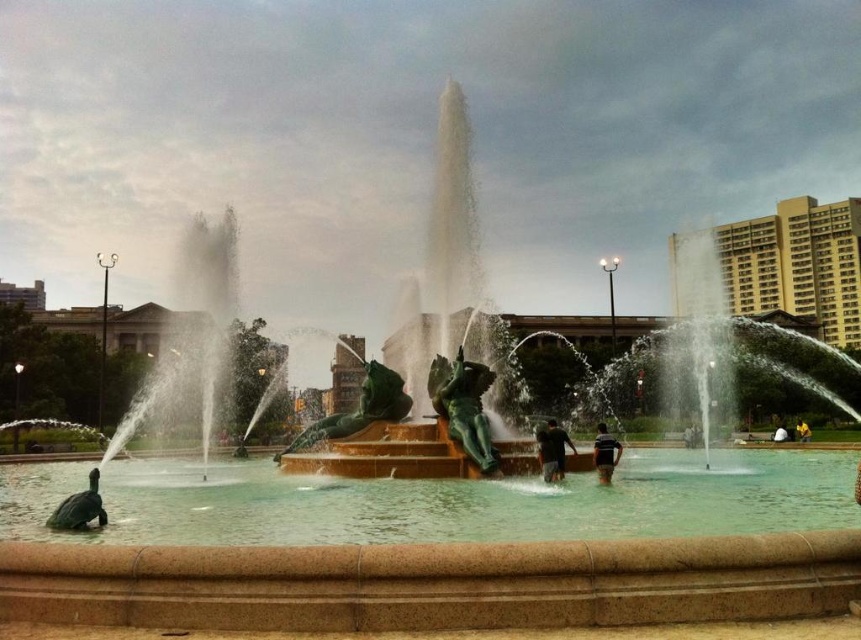
Can you confirm if green patina statue at center is positioned below black rubber person at center?

No, green patina statue at center is not below black rubber person at center.

Does green patina statue at center come in front of black rubber person at center?

Yes, green patina statue at center is closer to the viewer.

Identify the location of green patina statue at center. The height and width of the screenshot is (640, 861). (358, 410).

Does green patina stone sculpture at center appear over yellow fabric person at center?

Yes, green patina stone sculpture at center is above yellow fabric person at center.

Is green patina stone sculpture at center behind yellow fabric person at center?

That is False.

Does point (492, 460) lie in front of point (809, 436)?

That is True.

The image size is (861, 640). In order to click on green patina stone sculpture at center in this screenshot , I will do `click(463, 406)`.

Can you confirm if green patina stone sculpture at center is positioned to the left of green patina statue at center?

Incorrect, green patina stone sculpture at center is not on the left side of green patina statue at center.

Is green patina stone sculpture at center below green patina statue at center?

Incorrect, green patina stone sculpture at center is not positioned below green patina statue at center.

Which is in front, point (466, 364) or point (386, 400)?

Positioned in front is point (466, 364).

The image size is (861, 640). What are the coordinates of `green patina stone sculpture at center` in the screenshot? It's located at (463, 406).